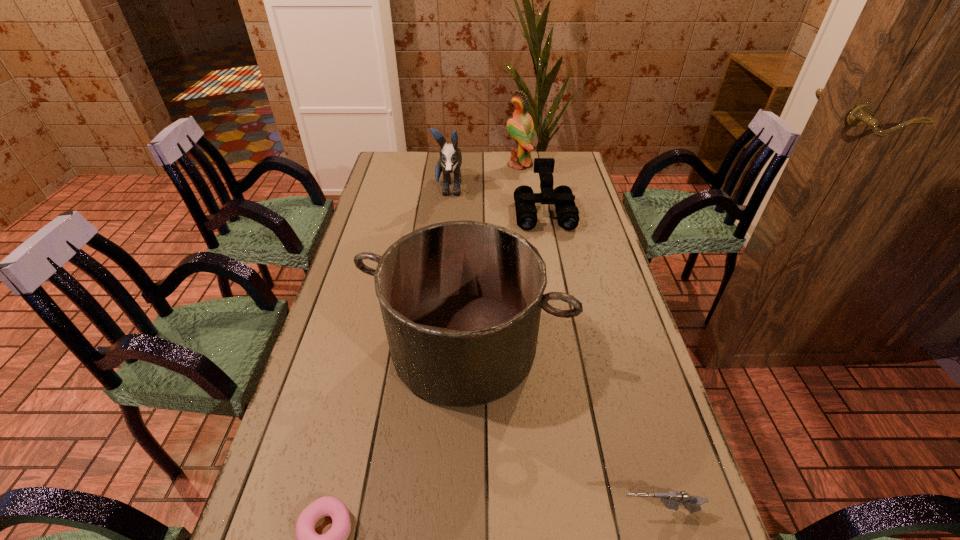
Where is `vacant space located on the front lenses of the third shortest object`? vacant space located on the front lenses of the third shortest object is located at coordinates (556, 275).

Where is `free region located at the barrel of the second shortest object`? This screenshot has height=540, width=960. free region located at the barrel of the second shortest object is located at coordinates click(x=520, y=511).

You are a GUI agent. You are given a task and a screenshot of the screen. Output one action in this format:
    pyautogui.click(x=<x>, y=<y>)
    Task: Click on the vacant point located at the barrel of the second shortest object
    
    Given the screenshot: What is the action you would take?
    pyautogui.click(x=427, y=511)

At what (x,y) coordinates should I click in order to perform the action: click on free location located at the barrel of the second shortest object. Please return your answer as a coordinate pair (x, y). Looking at the image, I should click on (417, 511).

At what (x,y) coordinates should I click in order to perform the action: click on parrot located in the far edge section of the desktop. Please return your answer as a coordinate pair (x, y). Image resolution: width=960 pixels, height=540 pixels. Looking at the image, I should click on [521, 128].

The height and width of the screenshot is (540, 960). I want to click on puppy situated at the far edge, so click(450, 161).

Where is `object at the left edge`? The width and height of the screenshot is (960, 540). object at the left edge is located at coordinates (461, 301).

Identify the location of binoculars at the right edge. (562, 197).

Image resolution: width=960 pixels, height=540 pixels. I want to click on gun that is at the right edge, so click(671, 500).

In order to click on vacant space at the far edge of the desktop in this screenshot , I will do pos(522,176).